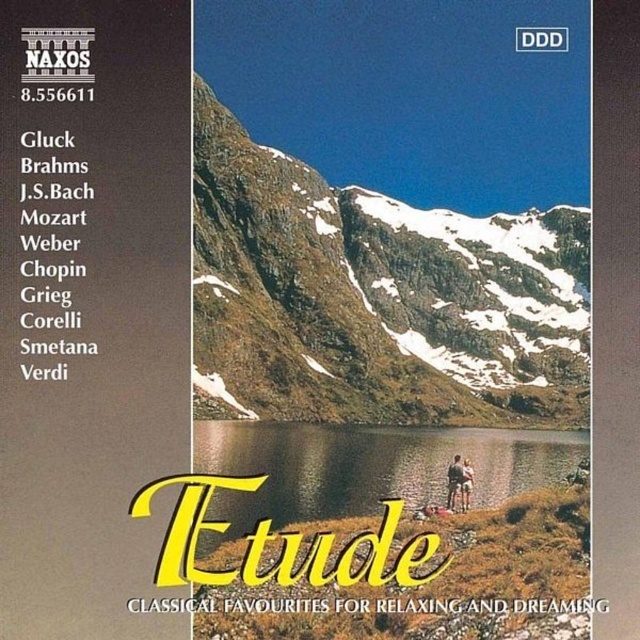
Does matte black text at upper left come behind brown leather jacket at lower center?

No, matte black text at upper left is in front of brown leather jacket at lower center.

Locate an element on the screen. matte black text at upper left is located at coordinates (90, 307).

Is point (10, 388) farther from viewer compared to point (452, 509)?

No, (10, 388) is in front of (452, 509).

Where is `matte black text at upper left`? The width and height of the screenshot is (640, 640). matte black text at upper left is located at coordinates (90, 307).

Is matte black text at upper left smaller than transparent water at center?

Indeed, matte black text at upper left has a smaller size compared to transparent water at center.

Does matte black text at upper left appear under transparent water at center?

No.

What do you see at coordinates (90, 307) in the screenshot?
I see `matte black text at upper left` at bounding box center [90, 307].

I want to click on matte black text at upper left, so click(90, 307).

In the scene shown: Between brown leather jacket at lower center and light brown leather jacket at lower right, which one appears on the left side from the viewer's perspective?

From the viewer's perspective, brown leather jacket at lower center appears more on the left side.

Does brown leather jacket at lower center have a larger size compared to light brown leather jacket at lower right?

Correct, brown leather jacket at lower center is larger in size than light brown leather jacket at lower right.

Image resolution: width=640 pixels, height=640 pixels. What are the coordinates of `brown leather jacket at lower center` in the screenshot? It's located at (452, 481).